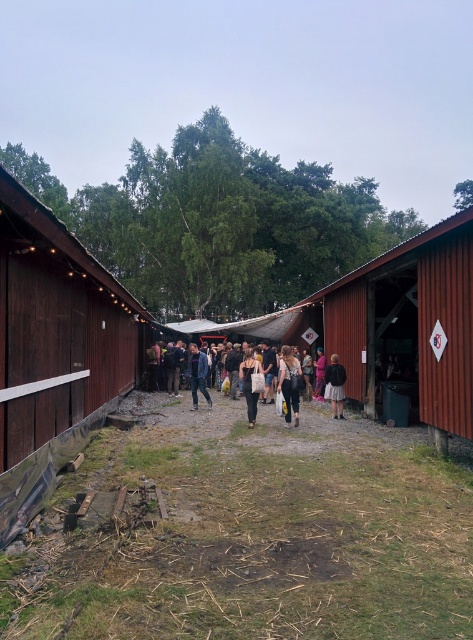
Question: Which object is the farthest from the matte black jacket at center?

Choices:
 (A) denim pants at center
 (B) matte black backpack at center

Answer: (A)

Question: Considering the real-world distances, which object is farthest from the denim pants at center?

Choices:
 (A) dark brown leather jacket at center
 (B) brushed wood barn at left
 (C) matte black backpack at center

Answer: (A)

Question: Observing the image, what is the correct spatial positioning of matte black jacket at center in reference to matte black backpack at center?

Choices:
 (A) right
 (B) left

Answer: (B)

Question: Does denim pants at center appear under matte black backpack at center?

Choices:
 (A) no
 (B) yes

Answer: (A)

Question: Based on their relative distances, which object is nearer to the matte black bag at center?

Choices:
 (A) denim pants at center
 (B) brushed wood barn at left

Answer: (A)

Question: Is brushed wood barn at left smaller than matte black jacket at center?

Choices:
 (A) yes
 (B) no

Answer: (B)